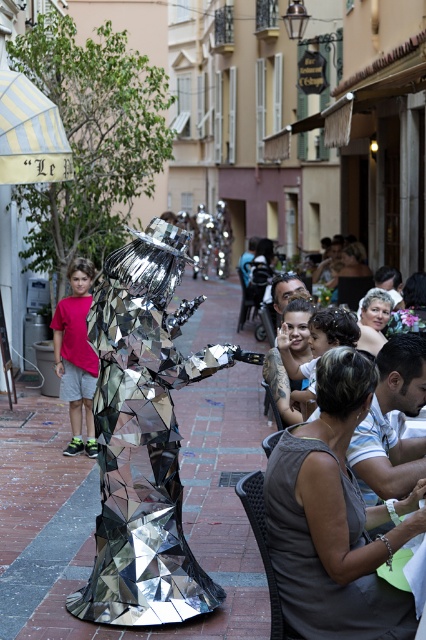
Which is below, mirrored metallic sculpture at center or shiny metallic robot at lower right?

Positioned lower is mirrored metallic sculpture at center.

In the scene shown: Which is more to the left, mirrored metallic sculpture at center or shiny metallic robot at lower right?

mirrored metallic sculpture at center

This screenshot has width=426, height=640. What are the coordinates of `mirrored metallic sculpture at center` in the screenshot? It's located at (143, 436).

Does point (333, 566) lie behind point (370, 445)?

No, (333, 566) is closer to viewer.

Between point (290, 570) and point (368, 470), which one is positioned in front?

Point (290, 570) is in front.

Image resolution: width=426 pixels, height=640 pixels. Describe the element at coordinates (334, 518) in the screenshot. I see `reflective metallic figure at center` at that location.

The width and height of the screenshot is (426, 640). Identify the location of reflective metallic figure at center. (334, 518).

How distant is mirrored metallic sculpture at center from reflective metallic figure at center?

They are 7.17 feet apart.

Can you confirm if mirrored metallic sculpture at center is positioned below reflective metallic figure at center?

Actually, mirrored metallic sculpture at center is above reflective metallic figure at center.

Between point (144, 371) and point (336, 362), which one is positioned in front?

Positioned in front is point (336, 362).

Identify the location of mirrored metallic sculpture at center. [x=143, y=436].